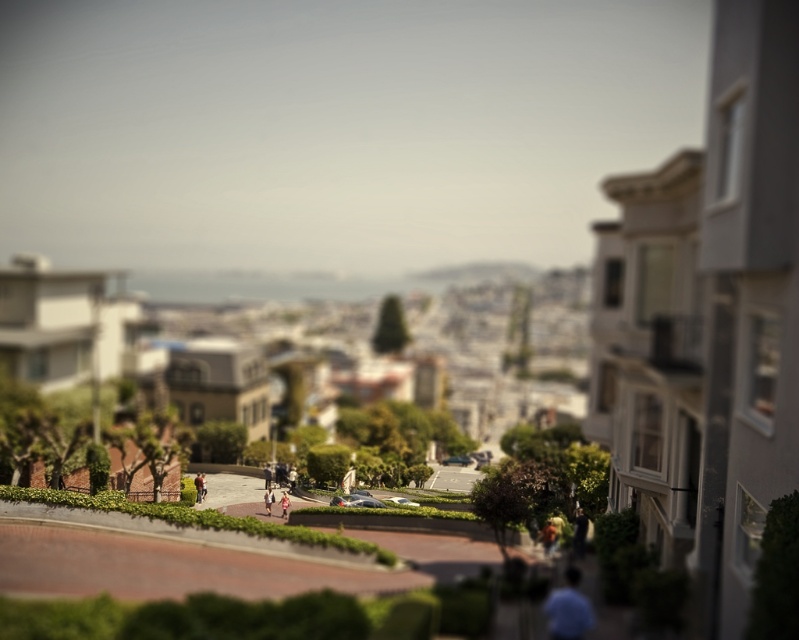
Can you confirm if light blue shirt at lower right is shorter than pink fabric dress at center?

Yes, light blue shirt at lower right is shorter than pink fabric dress at center.

Between light blue shirt at lower right and pink fabric dress at center, which one has more height?

pink fabric dress at center

Is point (567, 577) positioned after point (267, 497)?

No, it is in front of (267, 497).

Find the location of a particular element. The height and width of the screenshot is (640, 799). light blue shirt at lower right is located at coordinates (567, 609).

Can you confirm if red shirt at center is shorter than pink fabric dress at center?

No.

Image resolution: width=799 pixels, height=640 pixels. What do you see at coordinates (197, 486) in the screenshot?
I see `red shirt at center` at bounding box center [197, 486].

Who is more forward, (201, 474) or (267, 493)?

Point (267, 493) is more forward.

Locate an element on the screen. This screenshot has width=799, height=640. red shirt at center is located at coordinates (197, 486).

Is pink fabric dress at center shorter than light pink fabric at center?

Yes.

From the picture: Is pink fabric dress at center to the left of light pink fabric at center from the viewer's perspective?

Correct, you'll find pink fabric dress at center to the left of light pink fabric at center.

Find the location of a particular element. Image resolution: width=799 pixels, height=640 pixels. pink fabric dress at center is located at coordinates (268, 500).